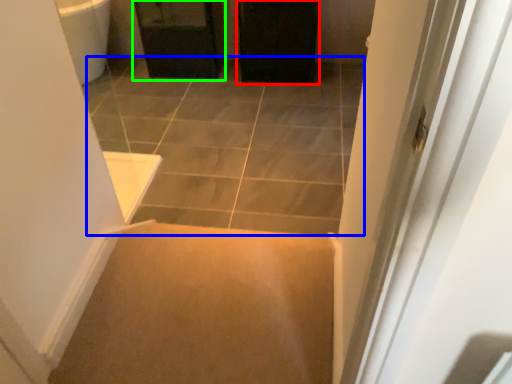
Question: Which object is the closest to the screen door (highlighted by a red box)? Choose among these: path (highlighted by a blue box) or cabinetry (highlighted by a green box).

Choices:
 (A) path
 (B) cabinetry

Answer: (B)